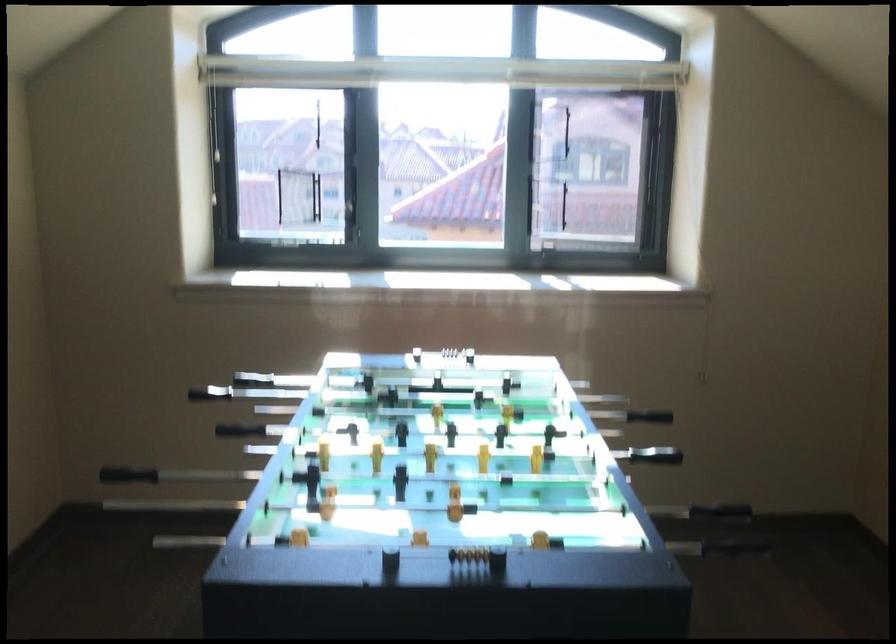
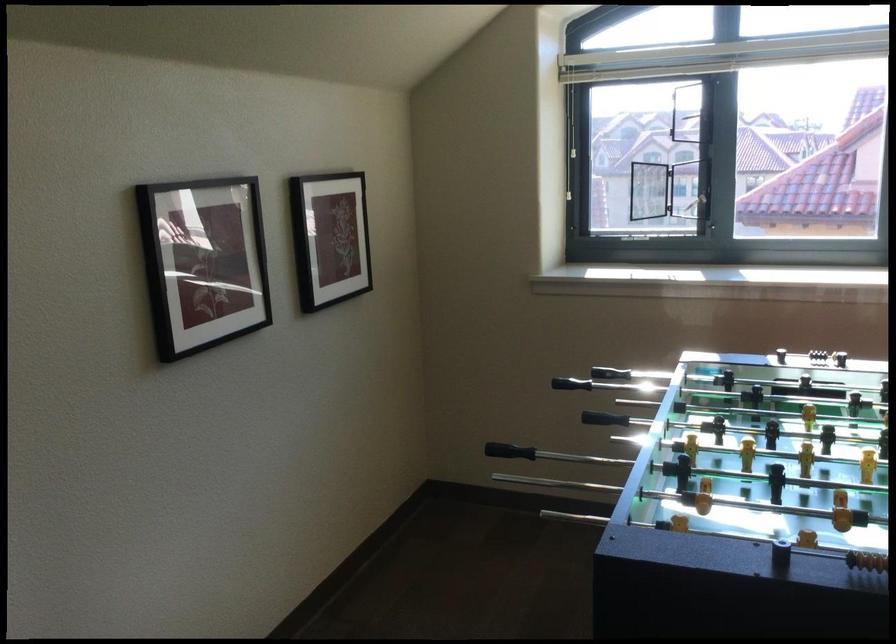
Locate, in the second image, the point that corresponds to the point at 144,476 in the first image.

(509, 451)